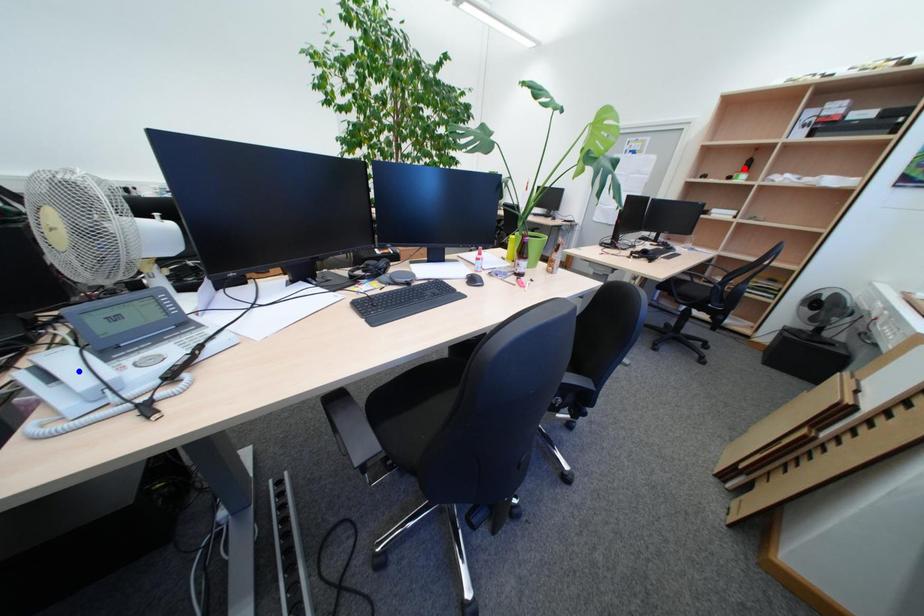
Question: In the image, two points are highlighted. Which point is nearer to the camera? Reply with the corresponding letter.

Choices:
 (A) blue point
 (B) red point

Answer: (A)